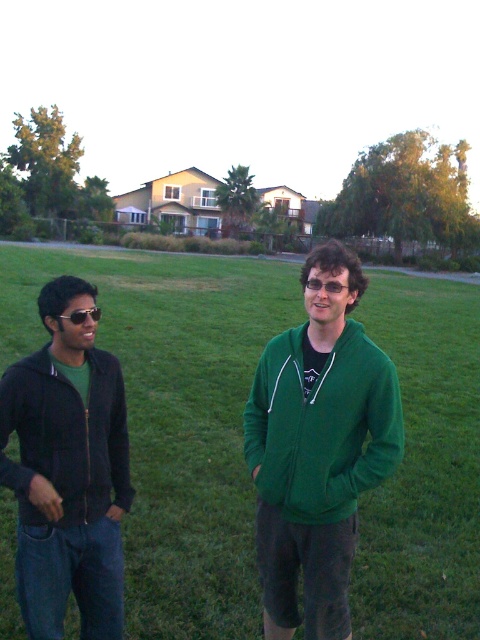
Question: Among these objects, which one is farthest from the camera?

Choices:
 (A) green matte hoodie at center
 (B) matte black jacket at left
 (C) black plastic sunglasses at left
 (D) green fleece jacket at center

Answer: (A)

Question: Is matte black jacket at left bigger than sunglasses at center?

Choices:
 (A) yes
 (B) no

Answer: (A)

Question: Is black plastic sunglasses at left in front of sunglasses at center?

Choices:
 (A) yes
 (B) no

Answer: (A)

Question: In this image, where is green matte hoodie at center located relative to green fleece jacket at center?

Choices:
 (A) left
 (B) right

Answer: (B)

Question: Among these points, which one is farthest from the camera?

Choices:
 (A) tap(95, 312)
 (B) tap(217, 257)
 (C) tap(48, 326)
 (D) tap(337, 282)

Answer: (B)

Question: Which is nearer to the black plastic sunglasses at left?

Choices:
 (A) green fleece jacket at center
 (B) matte black jacket at left
 (C) green matte hoodie at center
 (D) sunglasses at center

Answer: (B)